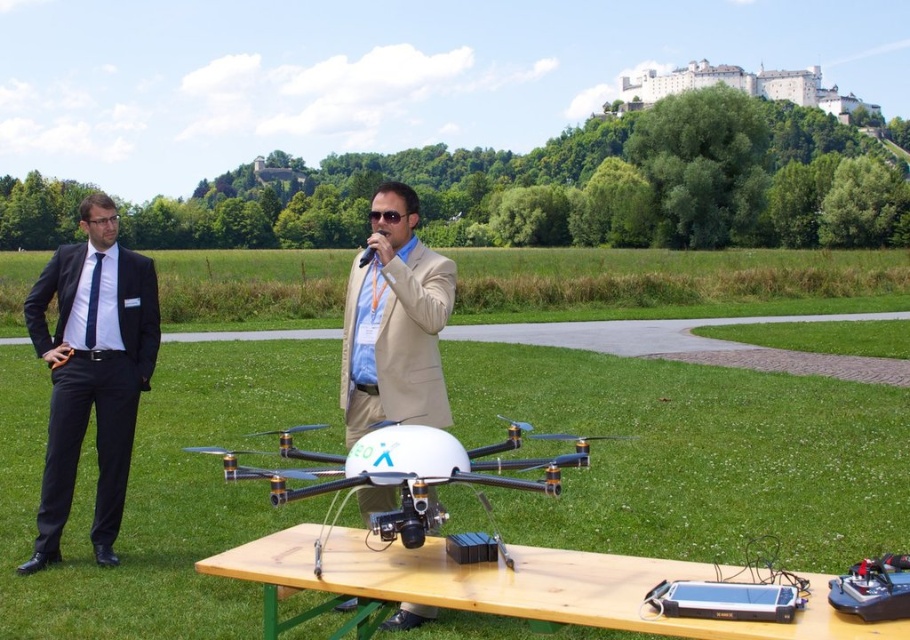
Question: Does black suit at left have a greater width compared to blue silk tie at left?

Choices:
 (A) no
 (B) yes

Answer: (B)

Question: Considering the relative positions of wooden table at center and black suit at left in the image provided, where is wooden table at center located with respect to black suit at left?

Choices:
 (A) left
 (B) right

Answer: (B)

Question: Which of these objects is positioned closest to the black suit at left?

Choices:
 (A) wooden table at center
 (B) beige fabric suit at center

Answer: (B)

Question: Does beige fabric suit at center lie in front of blue silk tie at left?

Choices:
 (A) yes
 (B) no

Answer: (A)

Question: Which point is farther from the camera taking this photo?

Choices:
 (A) pos(86,276)
 (B) pos(89,323)
 (C) pos(706,636)
 (D) pos(418,435)

Answer: (A)

Question: Which point is closer to the camera taking this photo?

Choices:
 (A) (344, 342)
 (B) (584, 616)
 (C) (340, 484)

Answer: (B)